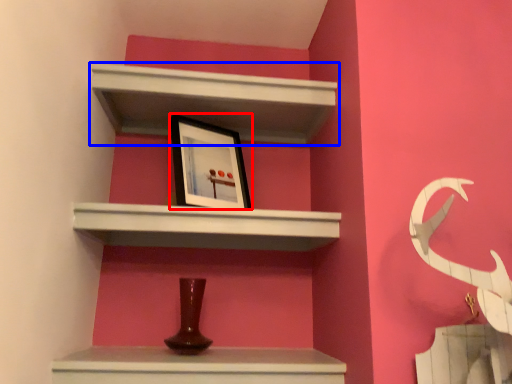
Question: Which object is closer to the camera taking this photo, picture frame (highlighted by a red box) or shelf (highlighted by a blue box)?

Choices:
 (A) picture frame
 (B) shelf

Answer: (B)